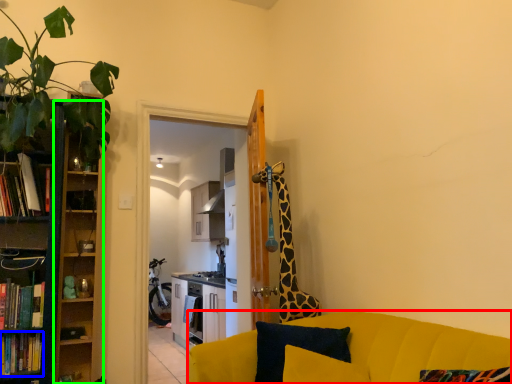
Question: Based on their relative distances, which object is nearer to studio couch (highlighted by a red box)? Choose from book (highlighted by a blue box) and cabinet (highlighted by a green box).

Choices:
 (A) book
 (B) cabinet

Answer: (B)